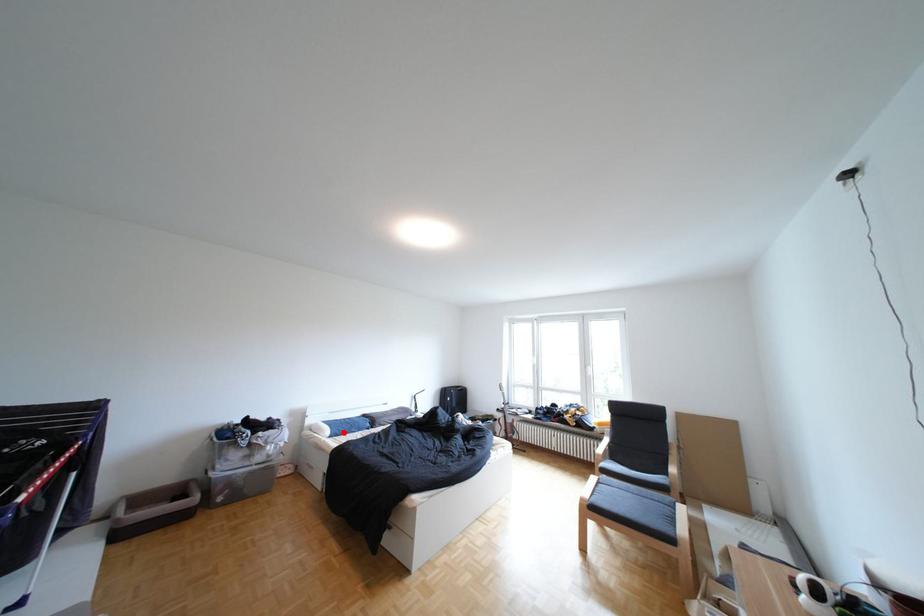
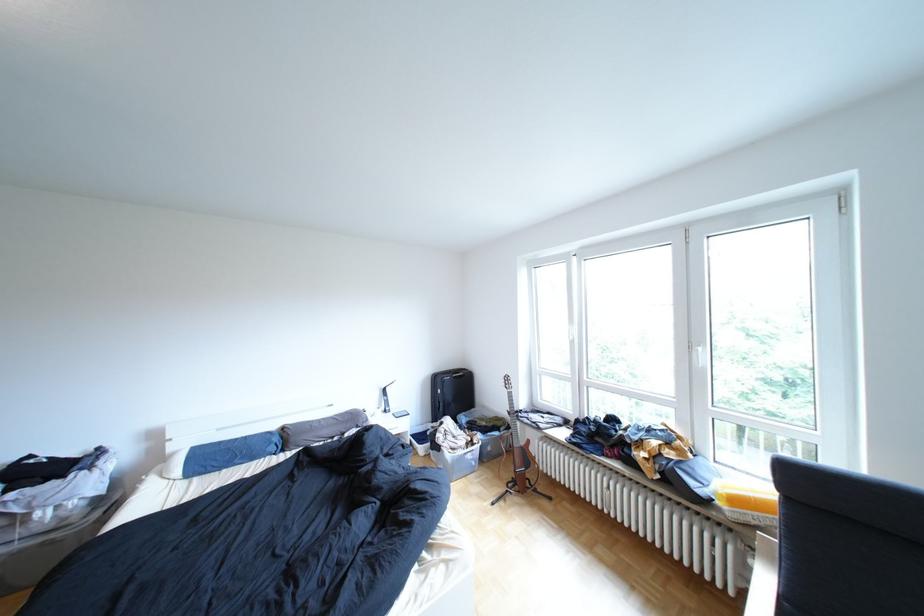
Question: A red point is marked in image1. In image2, is the corresponding 3D point closer to the camera or farther? Reply with the corresponding letter.

Choices:
 (A) The corresponding 3D point is closer.
 (B) The corresponding 3D point is farther.

Answer: (A)